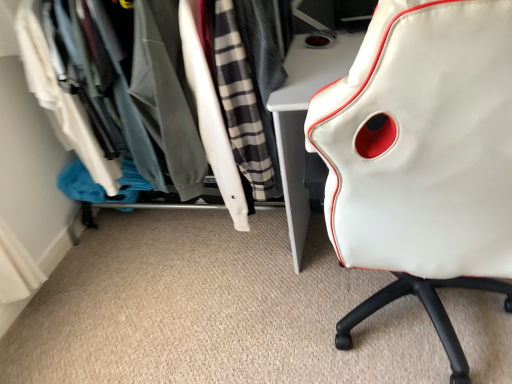
Question: Based on their sizes in the image, would you say white fabric closet at upper left is bigger or smaller than white leather chair at right?

Choices:
 (A) big
 (B) small

Answer: (A)

Question: From a real-world perspective, relative to white leather chair at right, is white fabric closet at upper left vertically above or below?

Choices:
 (A) below
 (B) above

Answer: (A)

Question: Looking at their shapes, would you say white fabric closet at upper left is wider or thinner than white leather chair at right?

Choices:
 (A) thin
 (B) wide

Answer: (A)

Question: Is white leather chair at right taller or shorter than white fabric closet at upper left?

Choices:
 (A) tall
 (B) short

Answer: (A)

Question: From a real-world perspective, is white leather chair at right physically located above or below white fabric closet at upper left?

Choices:
 (A) below
 (B) above

Answer: (B)

Question: Considering the positions of white leather chair at right and white fabric closet at upper left in the image, is white leather chair at right bigger or smaller than white fabric closet at upper left?

Choices:
 (A) big
 (B) small

Answer: (B)

Question: Considering their positions, is white leather chair at right located in front of or behind white fabric closet at upper left?

Choices:
 (A) front
 (B) behind

Answer: (A)